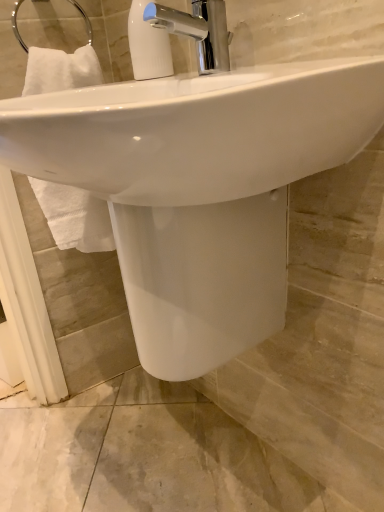
Question: Is there a large distance between white plastic soap dispenser at upper center and white glossy sink at center?

Choices:
 (A) no
 (B) yes

Answer: (A)

Question: Is the depth of white plastic soap dispenser at upper center greater than that of white glossy sink at center?

Choices:
 (A) yes
 (B) no

Answer: (A)

Question: From a real-world perspective, does white plastic soap dispenser at upper center stand above white glossy sink at center?

Choices:
 (A) no
 (B) yes

Answer: (B)

Question: Is white plastic soap dispenser at upper center closer to camera compared to white glossy sink at center?

Choices:
 (A) yes
 (B) no

Answer: (B)

Question: Can you confirm if white plastic soap dispenser at upper center is shorter than white glossy sink at center?

Choices:
 (A) yes
 (B) no

Answer: (A)

Question: Looking at the image, does chrome metallic faucet at upper center seem bigger or smaller compared to white plastic soap dispenser at upper center?

Choices:
 (A) big
 (B) small

Answer: (A)

Question: Based on their positions, is chrome metallic faucet at upper center located to the left or right of white plastic soap dispenser at upper center?

Choices:
 (A) right
 (B) left

Answer: (A)

Question: Does point (195, 8) appear closer or farther from the camera than point (167, 53)?

Choices:
 (A) closer
 (B) farther

Answer: (A)

Question: Is chrome metallic faucet at upper center spatially inside white plastic soap dispenser at upper center, or outside of it?

Choices:
 (A) outside
 (B) inside

Answer: (A)

Question: Based on their positions, is white glossy sink at center located to the left or right of chrome metallic faucet at upper center?

Choices:
 (A) left
 (B) right

Answer: (A)

Question: From the image's perspective, relative to chrome metallic faucet at upper center, is white glossy sink at center above or below?

Choices:
 (A) above
 (B) below

Answer: (B)

Question: Is point (193, 187) positioned closer to the camera than point (163, 8)?

Choices:
 (A) farther
 (B) closer

Answer: (B)

Question: Which is correct: white glossy sink at center is inside chrome metallic faucet at upper center, or outside of it?

Choices:
 (A) outside
 (B) inside

Answer: (A)

Question: In terms of size, does chrome metallic faucet at upper center appear bigger or smaller than white glossy sink at center?

Choices:
 (A) big
 (B) small

Answer: (B)

Question: From a real-world perspective, is chrome metallic faucet at upper center positioned above or below white glossy sink at center?

Choices:
 (A) below
 (B) above

Answer: (B)